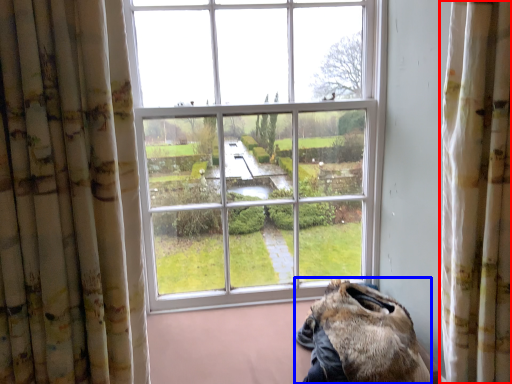
Question: Among these objects, which one is nearest to the camera, curtain (highlighted by a red box) or animal (highlighted by a blue box)?

Choices:
 (A) curtain
 (B) animal

Answer: (A)